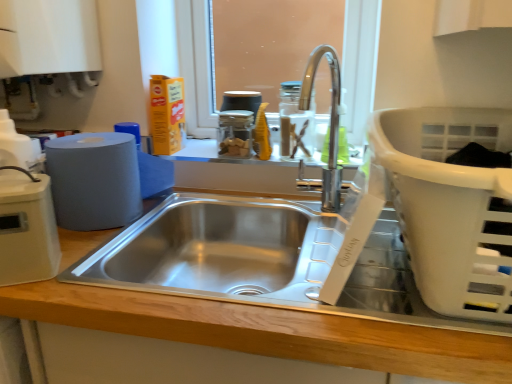
Locate an element on the screen. vacant space situated above matte gray paper towel at left (from a real-world perspective) is located at coordinates (92, 137).